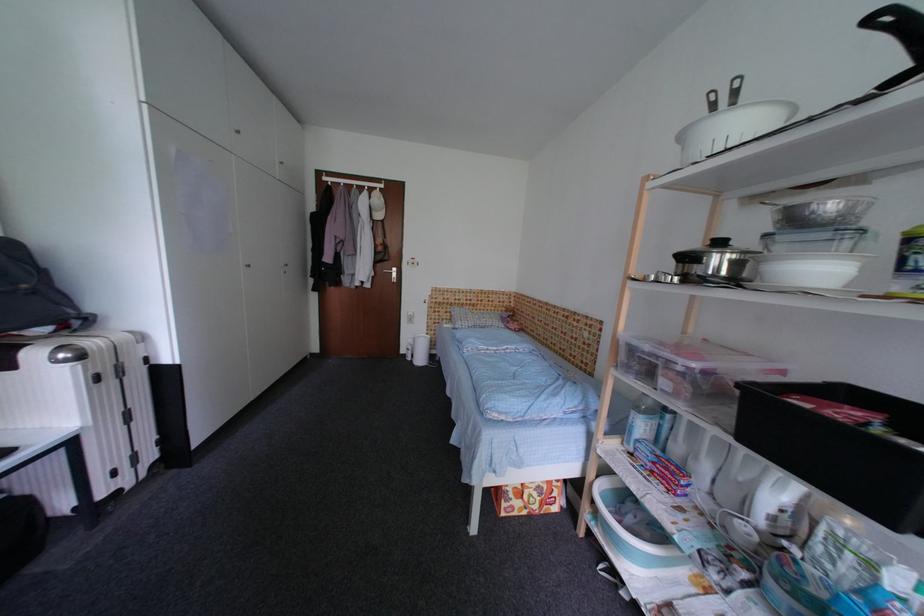
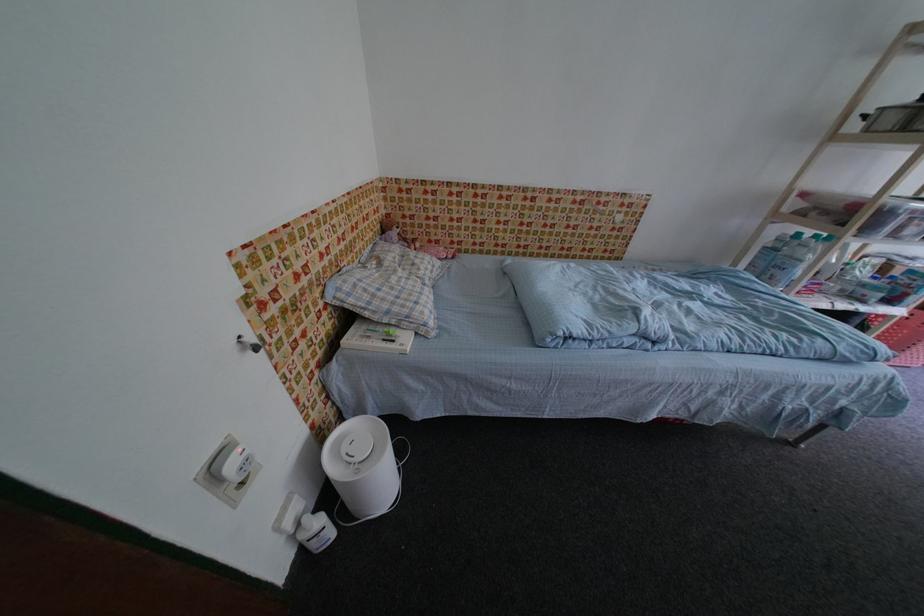
Find the pixel in the second image that matches (x=490, y=310) in the first image.

(370, 246)